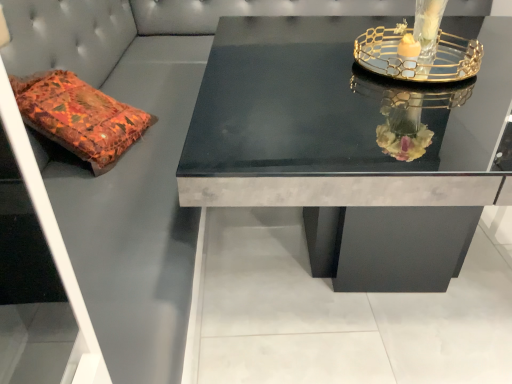
Question: In the image, is clear glass candle holder at upper right on the left side or the right side of black marble table at center?

Choices:
 (A) right
 (B) left

Answer: (A)

Question: Does point (470, 62) appear closer or farther from the camera than point (312, 69)?

Choices:
 (A) closer
 (B) farther

Answer: (A)

Question: From a real-world perspective, is clear glass candle holder at upper right above or below black marble table at center?

Choices:
 (A) below
 (B) above

Answer: (B)

Question: Is black marble table at center to the left or to the right of clear glass candle holder at upper right in the image?

Choices:
 (A) right
 (B) left

Answer: (B)

Question: From the image's perspective, relative to clear glass candle holder at upper right, is black marble table at center above or below?

Choices:
 (A) below
 (B) above

Answer: (A)

Question: Does point (322, 132) appear closer or farther from the camera than point (393, 77)?

Choices:
 (A) closer
 (B) farther

Answer: (A)

Question: Considering their positions, is black marble table at center located in front of or behind clear glass candle holder at upper right?

Choices:
 (A) behind
 (B) front

Answer: (B)